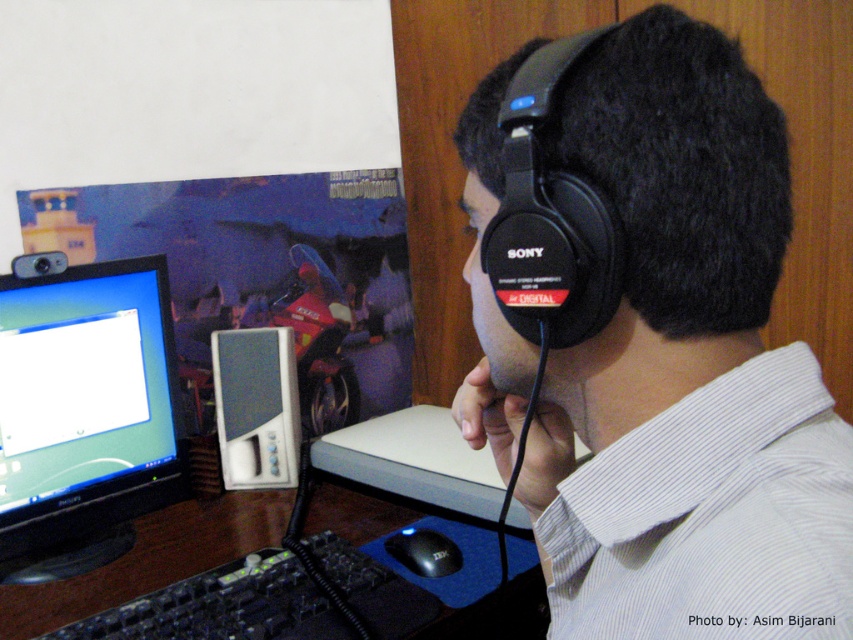
This screenshot has height=640, width=853. What do you see at coordinates (550, 218) in the screenshot?
I see `black matte sony headphones at upper right` at bounding box center [550, 218].

Does black matte sony headphones at upper right have a lesser width compared to white plastic speaker at center?

Correct, black matte sony headphones at upper right's width is less than white plastic speaker at center's.

The image size is (853, 640). Find the location of `black matte sony headphones at upper right`. black matte sony headphones at upper right is located at coordinates (550, 218).

This screenshot has height=640, width=853. I want to click on black matte sony headphones at upper right, so click(550, 218).

Is point (140, 592) behind point (241, 470)?

No, (140, 592) is closer to viewer.

In the scene shown: Can you confirm if black plastic keyboard at lower left is positioned below white plastic speaker at center?

Indeed, black plastic keyboard at lower left is positioned under white plastic speaker at center.

This screenshot has width=853, height=640. I want to click on black plastic keyboard at lower left, so click(x=149, y=557).

Locate an element on the screen. Image resolution: width=853 pixels, height=640 pixels. matte black monitor at left is located at coordinates (84, 413).

Can you confirm if matte black monitor at left is bigger than white plastic speaker at center?

Yes.

Which is behind, point (45, 417) or point (229, 340)?

The point (229, 340) is behind.

Find the location of a particular element. The width and height of the screenshot is (853, 640). matte black monitor at left is located at coordinates (84, 413).